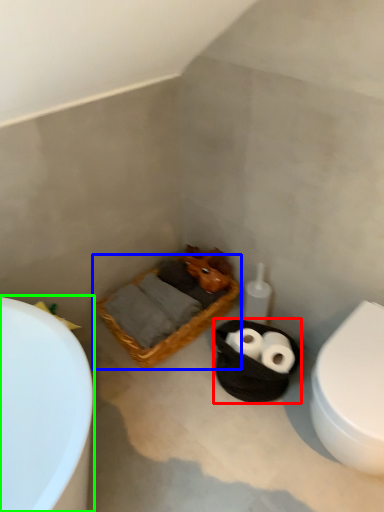
Question: Which object is positioned farthest from basket container (highlighted by a red box)? Select from basket (highlighted by a blue box) and bathtub (highlighted by a green box).

Choices:
 (A) basket
 (B) bathtub

Answer: (B)